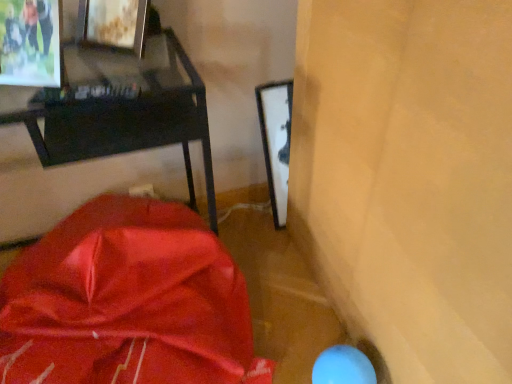
Locate an element on the screen. The width and height of the screenshot is (512, 384). satin red blanket at lower left is located at coordinates (125, 301).

How far apart are metallic silver picture frame at upper left and matte black desk at upper left?

6.64 inches.

Considering the sizes of objects metallic silver picture frame at upper left and matte black desk at upper left in the image provided, who is taller, metallic silver picture frame at upper left or matte black desk at upper left?

matte black desk at upper left is taller.

Is point (60, 35) closer or farther from the camera than point (120, 77)?

Point (60, 35) is farther from the camera than point (120, 77).

From a real-world perspective, is metallic silver picture frame at upper left beneath matte black desk at upper left?

No, from a real-world perspective, metallic silver picture frame at upper left is not beneath matte black desk at upper left.

Considering the sizes of objects metallic silver picture frame at upper left and satin red blanket at lower left in the image provided, who is shorter, metallic silver picture frame at upper left or satin red blanket at lower left?

metallic silver picture frame at upper left is shorter.

Is metallic silver picture frame at upper left next to satin red blanket at lower left and touching it?

They are not placed beside each other.

Is metallic silver picture frame at upper left oriented towards satin red blanket at lower left?

No, metallic silver picture frame at upper left is not aimed at satin red blanket at lower left.

Is metallic silver picture frame at upper left to the left of satin red blanket at lower left from the viewer's perspective?

Yes.

Which of these two, satin red blanket at lower left or metallic silver picture frame at upper left, stands shorter?

metallic silver picture frame at upper left is shorter.

From the image's perspective, which is above, satin red blanket at lower left or metallic silver picture frame at upper left?

metallic silver picture frame at upper left appears higher in the image.

Which of these two, satin red blanket at lower left or metallic silver picture frame at upper left, is thinner?

With smaller width is metallic silver picture frame at upper left.

Which is more to the left, matte black desk at upper left or metallic silver picture frame at upper left?

Positioned to the left is matte black desk at upper left.

From a real-world perspective, is matte black desk at upper left positioned above or below metallic silver picture frame at upper left?

matte black desk at upper left is below metallic silver picture frame at upper left.

Between matte black desk at upper left and metallic silver picture frame at upper left, which one is positioned behind?

metallic silver picture frame at upper left is further away from the camera.

Is matte black desk at upper left far away from metallic silver picture frame at upper left?

They are positioned close to each other.

Considering the relative sizes of satin red blanket at lower left and matte black desk at upper left in the image provided, is satin red blanket at lower left wider than matte black desk at upper left?

Yes.

Is satin red blanket at lower left positioned beyond the bounds of matte black desk at upper left?

No, satin red blanket at lower left is inside matte black desk at upper left's boundary.

Considering the relative positions of satin red blanket at lower left and matte black desk at upper left in the image provided, is satin red blanket at lower left to the left of matte black desk at upper left from the viewer's perspective?

No, satin red blanket at lower left is not to the left of matte black desk at upper left.

Considering their positions, is satin red blanket at lower left located in front of or behind matte black desk at upper left?

In the image, satin red blanket at lower left appears in front of matte black desk at upper left.

Between matte black desk at upper left and satin red blanket at lower left, which one appears on the right side from the viewer's perspective?

Positioned to the right is satin red blanket at lower left.

Is matte black desk at upper left aimed at satin red blanket at lower left?

Yes, matte black desk at upper left is oriented towards satin red blanket at lower left.

How far apart are matte black desk at upper left and satin red blanket at lower left?

They are 11.19 inches apart.

From the image's perspective, between matte black desk at upper left and satin red blanket at lower left, which one is located above?

From the image's view, matte black desk at upper left is above.

In the image, there is a metallic silver picture frame at upper left. In order to click on furniture below it (from the image's perspective) in this screenshot , I will do `click(122, 112)`.

Find the location of a particular element. wrap in front of the metallic silver picture frame at upper left is located at coordinates (125, 301).

Considering their positions, is satin red blanket at lower left positioned further to matte black desk at upper left than metallic silver picture frame at upper left?

satin red blanket at lower left.

Estimate the real-world distances between objects in this image. Which object is further from metallic silver picture frame at upper left, matte black desk at upper left or satin red blanket at lower left?

satin red blanket at lower left lies further to metallic silver picture frame at upper left than the other object.

Estimate the real-world distances between objects in this image. Which object is closer to satin red blanket at lower left, metallic silver picture frame at upper left or matte black desk at upper left?

matte black desk at upper left is closer to satin red blanket at lower left.

From the picture: Estimate the real-world distances between objects in this image. Which object is closer to satin red blanket at lower left, matte black desk at upper left or metallic silver picture frame at upper left?

Among the two, matte black desk at upper left is located nearer to satin red blanket at lower left.

In the scene shown: Which object lies nearer to the anchor point matte black desk at upper left, metallic silver picture frame at upper left or satin red blanket at lower left?

Based on the image, metallic silver picture frame at upper left appears to be nearer to matte black desk at upper left.

Which object lies nearer to the anchor point metallic silver picture frame at upper left, satin red blanket at lower left or matte black desk at upper left?

Among the two, matte black desk at upper left is located nearer to metallic silver picture frame at upper left.

Locate an element on the screen. The width and height of the screenshot is (512, 384). furniture that lies between metallic silver picture frame at upper left and satin red blanket at lower left from top to bottom is located at coordinates click(122, 112).